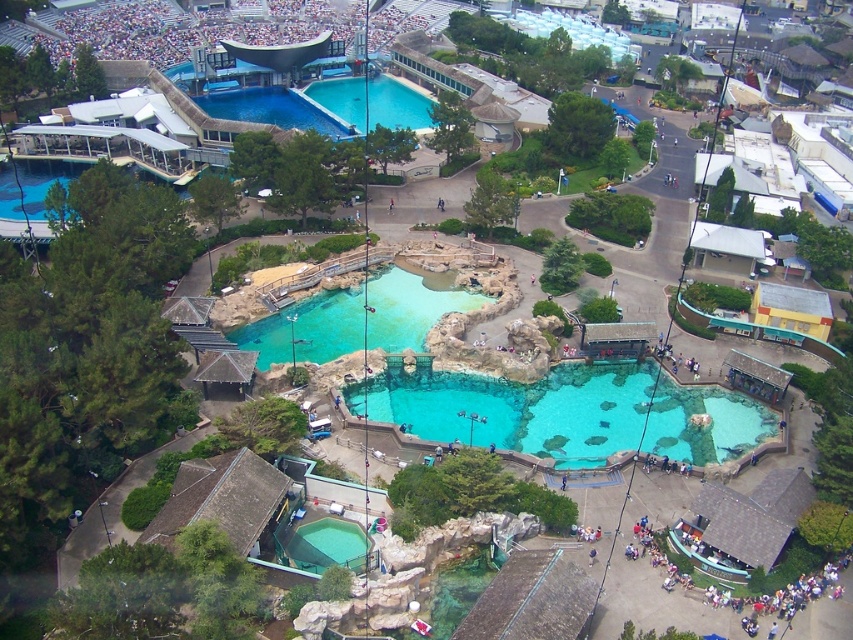
Question: Is turquoise glass pool at center below clear blue water at upper center?

Choices:
 (A) no
 (B) yes

Answer: (B)

Question: Among these points, which one is farthest from the camera?

Choices:
 (A) (410, 84)
 (B) (379, 276)
 (C) (519, 400)

Answer: (A)

Question: Which of the following is the closest to the observer?

Choices:
 (A) (404, 92)
 (B) (305, 307)

Answer: (B)

Question: Where is clear glass pool at center located in relation to turquoise glass pool at center in the image?

Choices:
 (A) left
 (B) right

Answer: (B)

Question: Among these objects, which one is farthest from the camera?

Choices:
 (A) turquoise glass pool at center
 (B) clear glass pool at center

Answer: (A)

Question: Does clear glass pool at center have a greater width compared to turquoise glass pool at center?

Choices:
 (A) yes
 (B) no

Answer: (A)